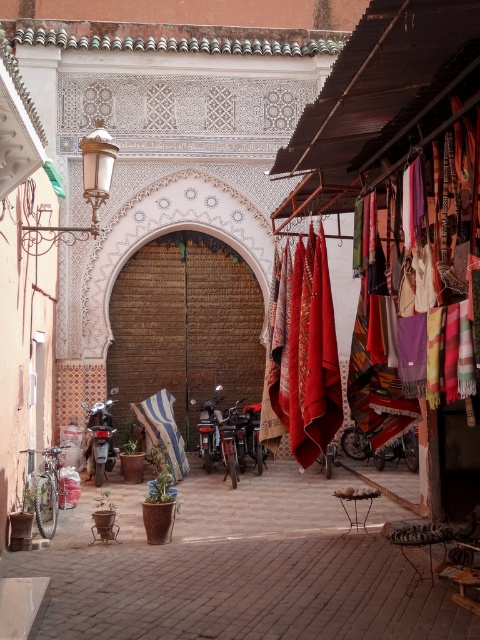
Does point (286, 374) lie behind point (136, 406)?

No.

Does textured woolen scarves at center have a lesser width compared to blue striped fabric at center?

Correct, textured woolen scarves at center's width is less than blue striped fabric at center's.

Does point (326, 326) come behind point (147, 406)?

No, it is in front of (147, 406).

Locate an element on the screen. This screenshot has height=640, width=480. textured woolen scarves at center is located at coordinates (305, 352).

Can you confirm if blue striped fabric at center is positioned below shiny metallic motorcycle at center?

Yes.

Can you confirm if blue striped fabric at center is positioned to the left of shiny metallic motorcycle at center?

Incorrect, blue striped fabric at center is not on the left side of shiny metallic motorcycle at center.

Image resolution: width=480 pixels, height=640 pixels. What do you see at coordinates (163, 429) in the screenshot?
I see `blue striped fabric at center` at bounding box center [163, 429].

You are a GUI agent. You are given a task and a screenshot of the screen. Output one action in this format:
    pyautogui.click(x=<x>, y=<y>)
    Task: Click on the blue striped fabric at center
    Image resolution: width=480 pixels, height=640 pixels.
    Given the screenshot: What is the action you would take?
    pyautogui.click(x=163, y=429)

Is textured woolen scarves at center further to the viewer compared to shiny metallic motorcycle at center?

That is False.

Between textured woolen scarves at center and shiny metallic motorcycle at center, which one appears on the left side from the viewer's perspective?

Positioned to the left is shiny metallic motorcycle at center.

Which is in front, point (295, 456) or point (111, 428)?

Point (295, 456) is in front.

This screenshot has height=640, width=480. What are the coordinates of `textured woolen scarves at center` in the screenshot? It's located at (305, 352).